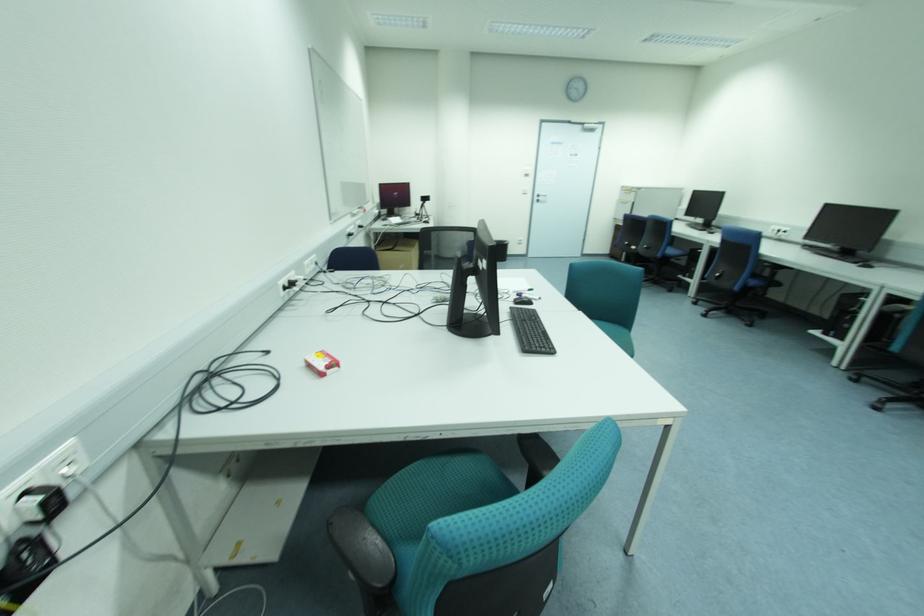
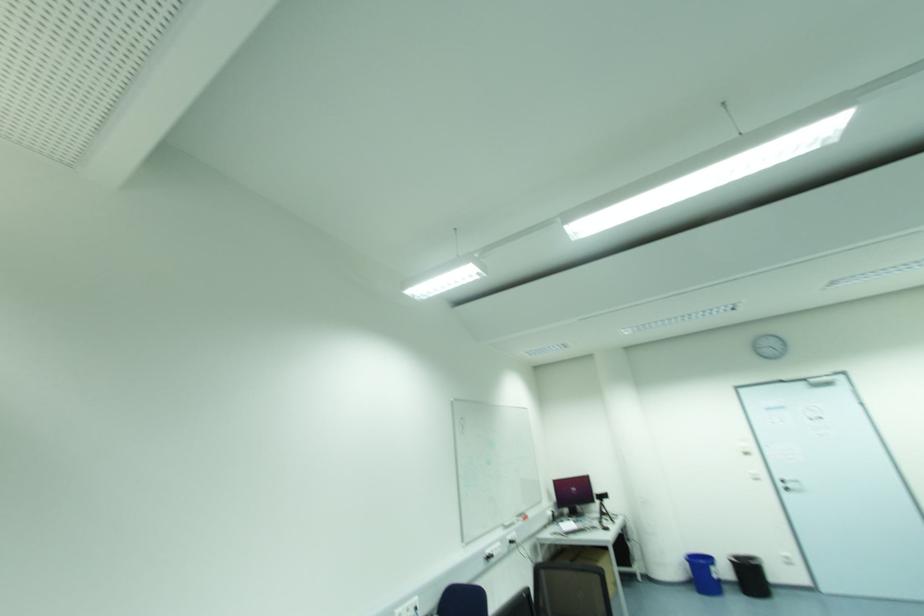
In the second image, find the point that corresponds to [541,199] in the first image.

(789, 485)